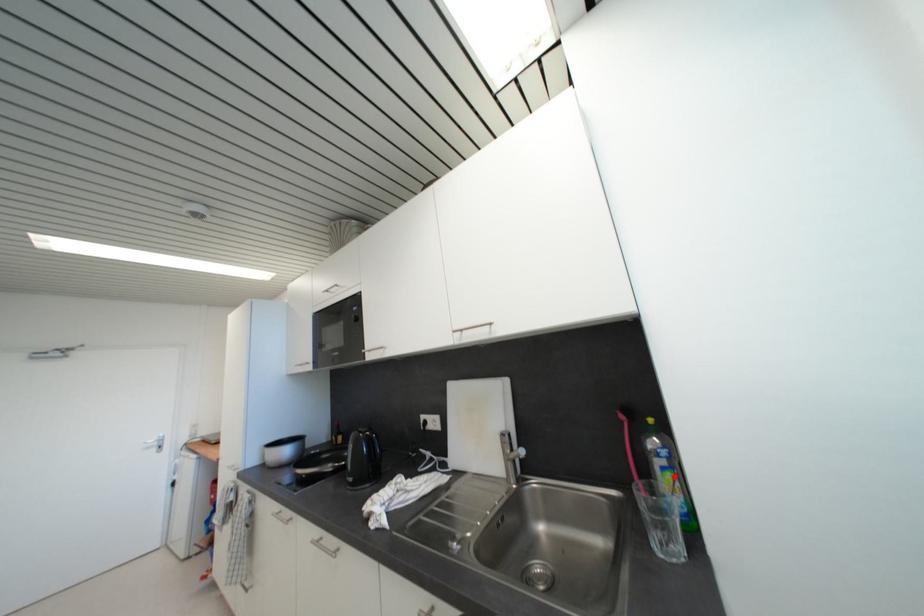
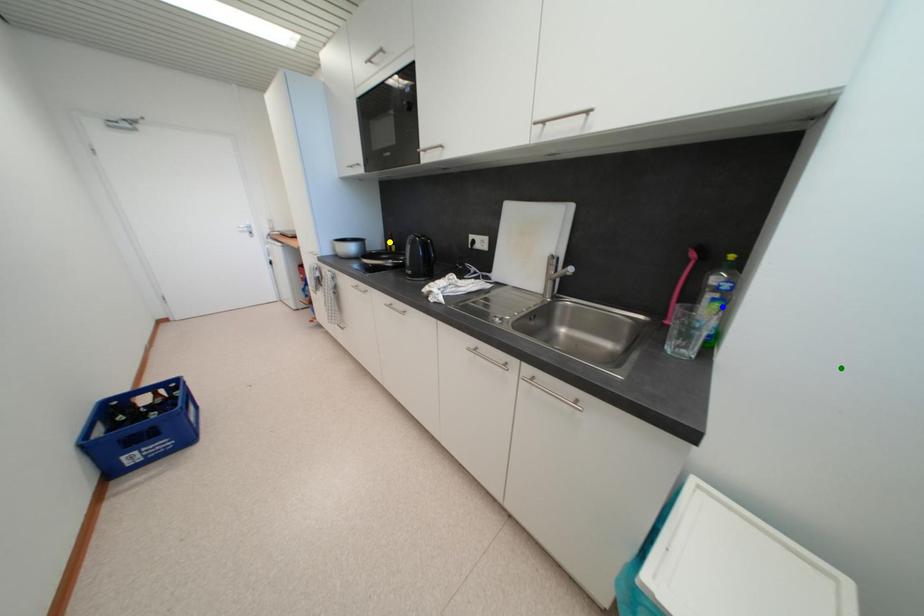
Question: I am providing you with two images of the same scene from different viewpoints. A red point is marked on the first image. You are given multiple points on the second image. Can you choose the point in image 2 that corresponds to the point in image 1?

Choices:
 (A) green point
 (B) blue point
 (C) yellow point

Answer: (B)